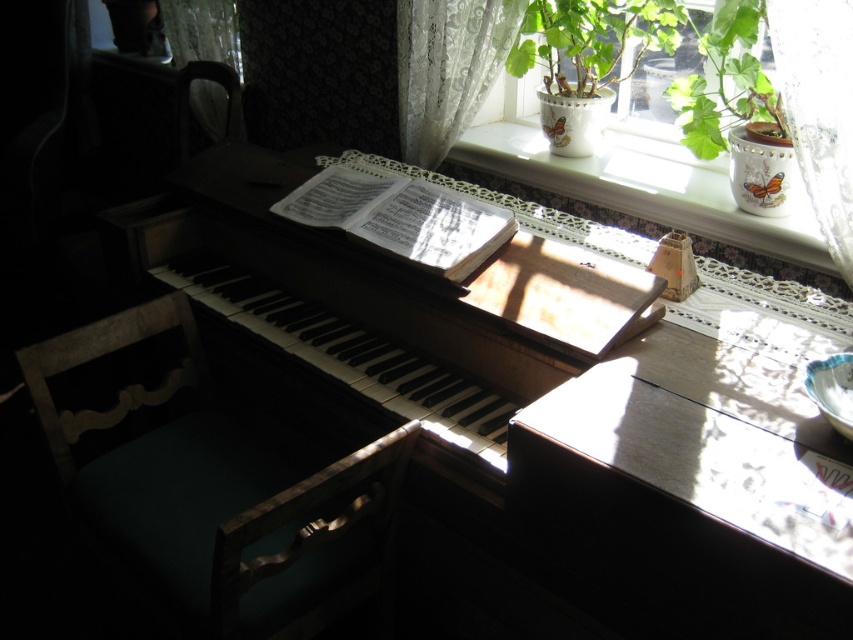
Is white lace at upper right wider than green leafy plant at upper right?

Yes, white lace at upper right is wider than green leafy plant at upper right.

Image resolution: width=853 pixels, height=640 pixels. Describe the element at coordinates (645, 188) in the screenshot. I see `white lace at upper right` at that location.

You are a GUI agent. You are given a task and a screenshot of the screen. Output one action in this format:
    pyautogui.click(x=<x>, y=<y>)
    Task: Click on the white lace at upper right
    The height and width of the screenshot is (640, 853).
    Given the screenshot: What is the action you would take?
    pyautogui.click(x=645, y=188)

Who is shorter, green fabric chair at lower left or white lace curtain at upper right?

Standing shorter between the two is white lace curtain at upper right.

You are a GUI agent. You are given a task and a screenshot of the screen. Output one action in this format:
    pyautogui.click(x=<x>, y=<y>)
    Task: Click on the green fabric chair at lower left
    This screenshot has width=853, height=640.
    Given the screenshot: What is the action you would take?
    pyautogui.click(x=215, y=493)

I want to click on green fabric chair at lower left, so click(215, 493).

Can you confirm if green fabric chair at lower left is smaller than white lace at upper right?

No.

Who is more distant from viewer, (270, 600) or (735, 216)?

Positioned behind is point (735, 216).

You are a GUI agent. You are given a task and a screenshot of the screen. Output one action in this format:
    pyautogui.click(x=<x>, y=<y>)
    Task: Click on the green fabric chair at lower left
    This screenshot has width=853, height=640.
    Given the screenshot: What is the action you would take?
    pyautogui.click(x=215, y=493)

The width and height of the screenshot is (853, 640). I want to click on green fabric chair at lower left, so click(215, 493).